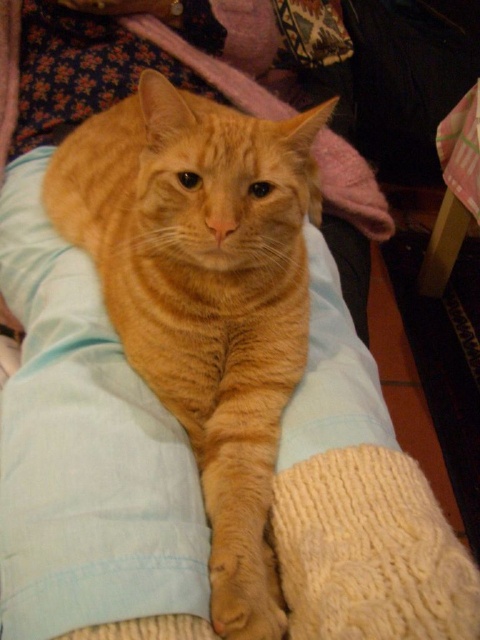
You are a cat breeder who wants to ensure the cat has enough space to stretch out comfortably. Given that the orange fur cat at center is wider than the light blue fabric pillow at center, will the pillow be sufficient for the cat to lie on without feeling cramped?

The orange fur cat at center is wider than the light blue fabric pillow at center, so the pillow may not provide enough space for the cat to lie comfortably without feeling cramped.

You are holding a camera and want to take a photo of the orange fur cat at center. The camera requires a minimum distance of 24 inches to focus properly. Can you take a clear photo without moving closer?

The orange fur cat at center and camera are 26.17 inches apart from each other, which is greater than the minimum required distance of 24 inches. Therefore, you can take a clear photo without moving closer.

You are a photographer trying to capture the orange fur cat at center. The camera you are using has a focus point at coordinate point (x=204, y=296). Will the orange fur cat at center be in focus?

Yes, the orange fur cat at center is at point (x=204, y=296), so the focus point will capture it clearly.